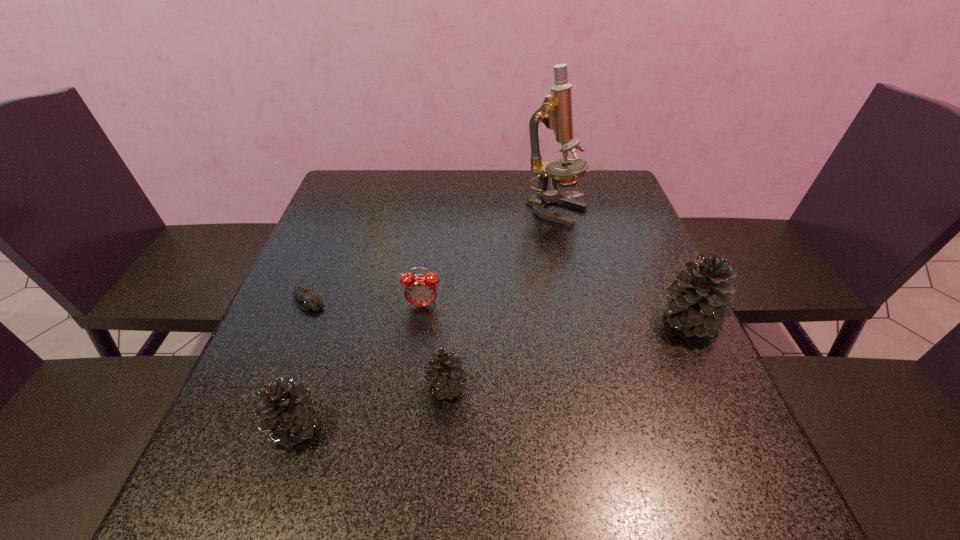
The height and width of the screenshot is (540, 960). I want to click on unoccupied area between the second object from right to left and the rightmost pinecone, so click(623, 266).

Locate an element on the screen. This screenshot has width=960, height=540. free area in between the alarm clock and the second pinecone from right to left is located at coordinates (435, 346).

Where is `free space between the farthest object and the second pinecone from right to left`? This screenshot has height=540, width=960. free space between the farthest object and the second pinecone from right to left is located at coordinates click(502, 299).

Find the location of a particular element. This screenshot has width=960, height=540. empty location between the fifth object from left to right and the computer mouse is located at coordinates (432, 256).

This screenshot has width=960, height=540. Find the location of `free spot between the leftmost pinecone and the alarm clock`. free spot between the leftmost pinecone and the alarm clock is located at coordinates (x=359, y=367).

Identify which object is the closest to the leftmost pinecone. Please provide its 2D coordinates. Your answer should be formatted as a tuple, i.e. [(x, y)], where the tuple contains the x and y coordinates of a point satisfying the conditions above.

[(445, 372)]

Where is `object that is the closest one to the alarm clock`? object that is the closest one to the alarm clock is located at coordinates (445, 372).

Select which pinecone appears as the second closest to the shortest pinecone. Please provide its 2D coordinates. Your answer should be formatted as a tuple, i.e. [(x, y)], where the tuple contains the x and y coordinates of a point satisfying the conditions above.

[(697, 302)]

You are a GUI agent. You are given a task and a screenshot of the screen. Output one action in this format:
    pyautogui.click(x=<x>, y=<y>)
    Task: Click on the pinecone that is the second closest to the tallest pinecone
    
    Given the screenshot: What is the action you would take?
    pyautogui.click(x=291, y=412)

Identify the location of free space that satisfies the following two spatial constraints: 1. on the back side of the microscope; 2. on the left side of the leftmost pinecone. (369, 212).